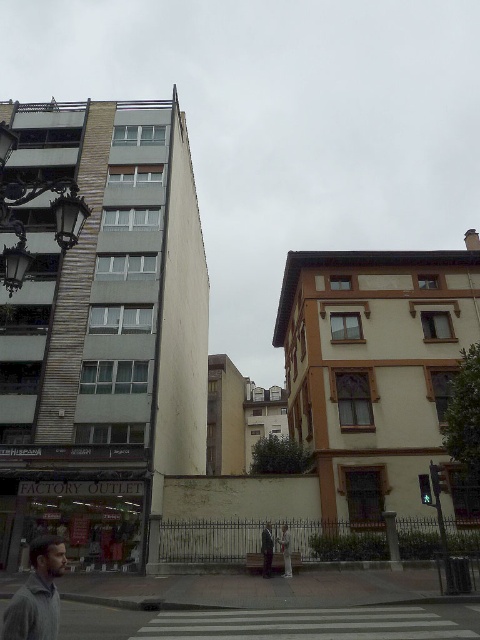
Question: Considering the relative positions of gray woolen sweater at lower left and dark gray suit at center in the image provided, where is gray woolen sweater at lower left located with respect to dark gray suit at center?

Choices:
 (A) below
 (B) above

Answer: (B)

Question: Is gray woolen sweater at lower left thinner than dark gray suit at center?

Choices:
 (A) no
 (B) yes

Answer: (A)

Question: Which point is closer to the camera taking this photo?

Choices:
 (A) (264, 536)
 (B) (60, 557)

Answer: (B)

Question: Can you confirm if gray woolen sweater at lower left is positioned above dark gray suit at center?

Choices:
 (A) yes
 (B) no

Answer: (A)